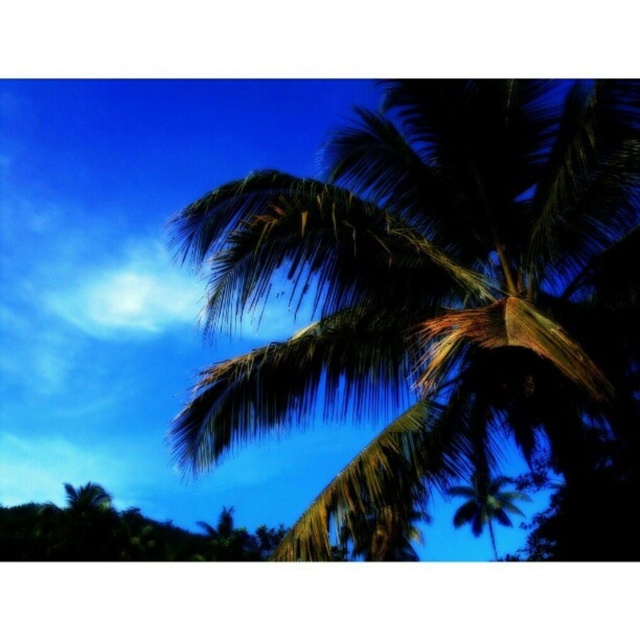
You are planning to plant a new tree in your backyard and have two options from the image. The dark green leafy coconut tree at upper right and the green leafy palm tree at center. Which tree would require more space due to its size?

The dark green leafy coconut tree at upper right is larger in size than the green leafy palm tree at center, so it would require more space.

You are a bird looking for a nesting spot. You see the dark green leafy coconut tree at upper right and the green leafy palm tree at center. Which tree has a wider canopy to accommodate your nest?

The dark green leafy coconut tree at upper right has a wider canopy than the green leafy palm tree at center, so it can accommodate your nest better.

In the scene shown: You are standing in a tropical area and want to take a photo of the palm tree. You are currently at a point located at coordinates point (301, 406). If the recommended distance for a clear photo is 25 feet, will you be able to capture the palm tree clearly from your current position?

The distance of point (301, 406) from camera is 26.10 feet, which is slightly beyond the recommended 25 feet. Therefore, you may need to move closer to ensure the palm tree is captured clearly in your photo.